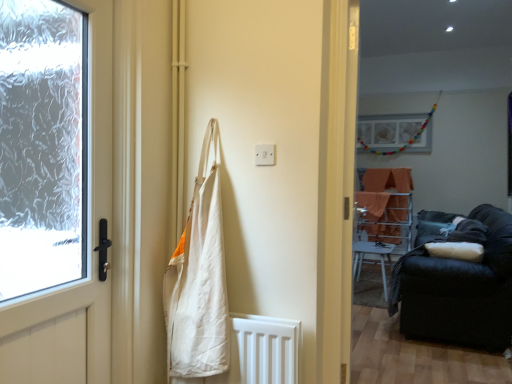
Question: From the image's perspective, is orange fabric at center on black fabric couch at right?

Choices:
 (A) no
 (B) yes

Answer: (A)

Question: Is orange fabric at center completely or partially outside of black fabric couch at right?

Choices:
 (A) no
 (B) yes

Answer: (B)

Question: Is black fabric couch at right located within orange fabric at center?

Choices:
 (A) yes
 (B) no

Answer: (B)

Question: Is orange fabric at center bigger than black fabric couch at right?

Choices:
 (A) no
 (B) yes

Answer: (B)

Question: From the image's perspective, is orange fabric at center beneath black fabric couch at right?

Choices:
 (A) no
 (B) yes

Answer: (B)

Question: From a real-world perspective, is orange fabric at center positioned over black fabric couch at right based on gravity?

Choices:
 (A) yes
 (B) no

Answer: (B)

Question: Is matte white door at left shorter than white canvas bag at center?

Choices:
 (A) yes
 (B) no

Answer: (B)

Question: From a real-world perspective, is matte white door at left located higher than white canvas bag at center?

Choices:
 (A) no
 (B) yes

Answer: (B)

Question: Is matte white door at left outside white canvas bag at center?

Choices:
 (A) yes
 (B) no

Answer: (A)

Question: Considering the relative sizes of matte white door at left and white canvas bag at center in the image provided, is matte white door at left smaller than white canvas bag at center?

Choices:
 (A) yes
 (B) no

Answer: (B)

Question: Does matte white door at left lie behind white canvas bag at center?

Choices:
 (A) no
 (B) yes

Answer: (A)

Question: Is matte white door at left directly adjacent to white canvas bag at center?

Choices:
 (A) yes
 (B) no

Answer: (B)

Question: Is orange fabric at center smaller than white canvas bag at center?

Choices:
 (A) no
 (B) yes

Answer: (A)